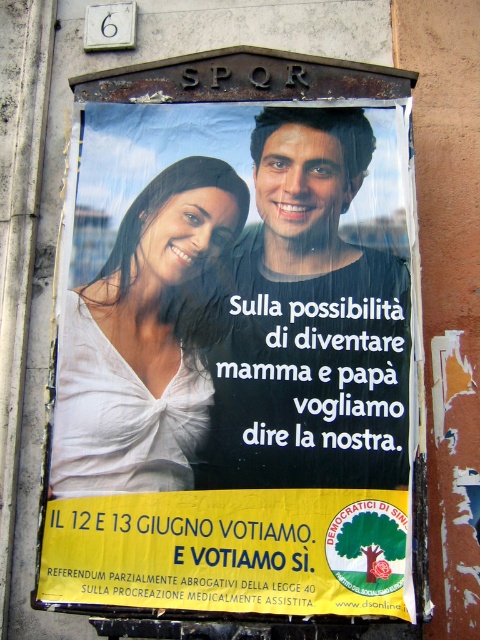
You are standing in front of a poster on a wall and see the white fabric poster at center and the matte black shirt at center. Which object is positioned to the left?

The white fabric poster at center is to the left of the matte black shirt at center, so the white fabric poster at center is positioned to the left.

You are an art student analyzing the composition of the image. You notice the white fabric poster at center and the white satin blouse at upper left. Which object is closer to the viewer?

The white fabric poster at center is closer to the viewer because it is in front of the white satin blouse at upper left.

You are designing a layout for a poster and need to ensure that the text will fit between the matte black shirt at center and the white satin blouse at upper left. Given that the text requires a minimum width of 30 cm, can the space between them accommodate it?

The matte black shirt at center is wider than the white satin blouse at upper left. However, without specific measurements of the space between them, it is impossible to determine if the 30 cm text width requirement can be met. The description only provides information about their widths, not the distance between them.